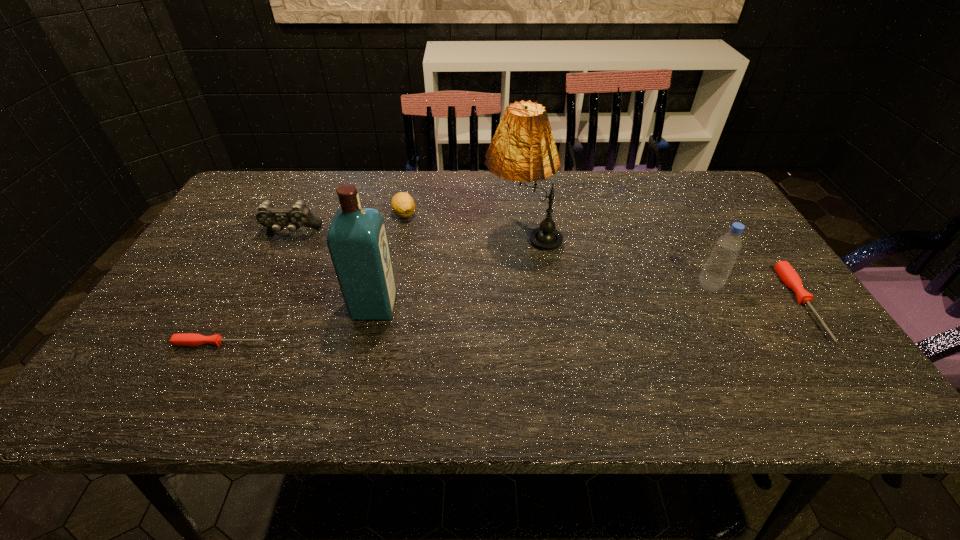
The image size is (960, 540). Identify the location of vacant space positioned 0.070m at the tip of the left screwdriver. (299, 343).

Where is `free space located at the tip of the sixth tallest object`? The width and height of the screenshot is (960, 540). free space located at the tip of the sixth tallest object is located at coordinates (847, 366).

Find the location of `vacant area situated 0.060m on the front-facing side of the lampshade`. vacant area situated 0.060m on the front-facing side of the lampshade is located at coordinates (462, 236).

Identify the location of vacant area situated 0.250m on the front-facing side of the lampshade. The height and width of the screenshot is (540, 960). (394, 236).

What are the coordinates of `vacant space situated 0.300m on the front-facing side of the lampshade` in the screenshot? It's located at (376, 236).

Identify the location of blank space located on the surface of the control with buttons. (238, 342).

Locate an element on the screen. The height and width of the screenshot is (540, 960). vacant area located at the stem end of the lemon is located at coordinates (398, 241).

I want to click on blank area located on the back of the bottle, so click(694, 256).

Find the location of a particular element. The width and height of the screenshot is (960, 540). vacant area situated on the flat label side of the liquor is located at coordinates (501, 306).

Locate an element on the screen. Image resolution: width=960 pixels, height=540 pixels. object that is at the far edge is located at coordinates (403, 205).